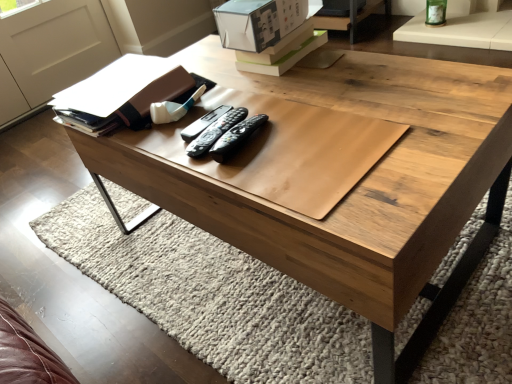
What are the coordinates of `vacant area situated to the left side of black plastic remote at center, the 3th remote when ordered from left to right` in the screenshot? It's located at (170, 153).